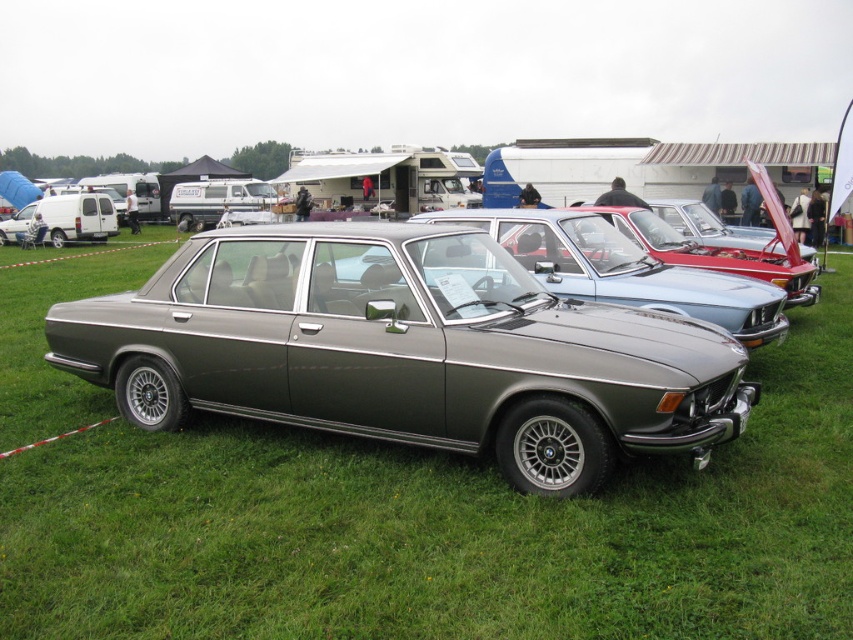
Consider the image. Who is more distant from viewer, (132, 362) or (665, 304)?

The point (665, 304) is more distant.

Can you confirm if satin metallic car at center is bigger than metallic gray sedan at center?

Yes, satin metallic car at center is bigger than metallic gray sedan at center.

Does point (331, 349) lie behind point (699, 308)?

No.

At what (x,y) coordinates should I click in order to perform the action: click on satin metallic car at center. Please return your answer as a coordinate pair (x, y). The height and width of the screenshot is (640, 853). Looking at the image, I should click on (405, 349).